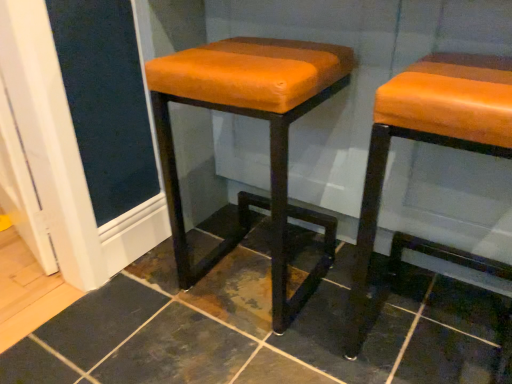
Identify the location of free space above orange leather stool at center, which ranks as the first stool in left-to-right order (from a real-world perspective). Image resolution: width=512 pixels, height=384 pixels. (249, 54).